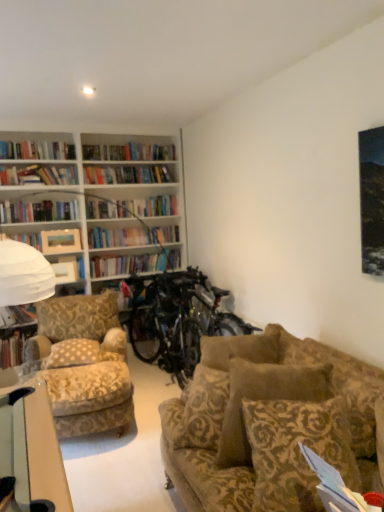
Question: Considering the relative positions of suede-patterned couch at center and white paper at lower right in the image provided, is suede-patterned couch at center to the left or to the right of white paper at lower right?

Choices:
 (A) right
 (B) left

Answer: (B)

Question: From the image's perspective, relative to white paper at lower right, is suede-patterned couch at center above or below?

Choices:
 (A) below
 (B) above

Answer: (B)

Question: Which object is the farthest from the hardcover book at left, the 1th book in the top-to-bottom sequence?

Choices:
 (A) matte white picture frame at upper left, acting as the 1th picture frame starting from the bottom
 (B) suede-patterned couch at center
 (C) metallic silver bicycle at center
 (D) beige patterned pillow at center-left, the first pillow in the back-to-front sequence
 (E) white paper at lower right

Answer: (E)

Question: Which object is the closest to the hardcover book at left, the second book when ordered from top to bottom?

Choices:
 (A) matte white picture frame at upper left, the 2th picture frame from the top
 (B) metallic silver bicycle at center
 (C) hardcover book at left, the 1th book in the top-to-bottom sequence
 (D) brown patterned pillow at lower right, placed as the first pillow when sorted from right to left
 (E) matte wooden picture frame at upper left, which appears as the 2th picture frame when ordered from the bottom

Answer: (C)